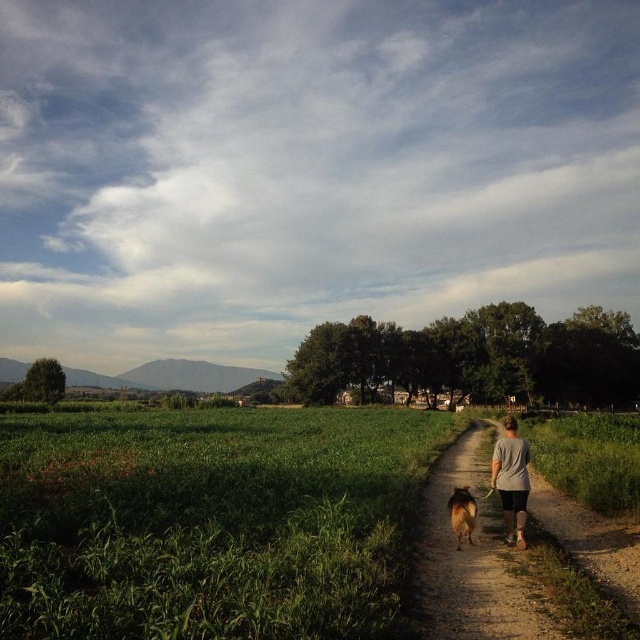
Does gray fabric shirt at center have a larger size compared to brown furry dog at center?

Indeed, gray fabric shirt at center has a larger size compared to brown furry dog at center.

Can you confirm if gray fabric shirt at center is positioned to the right of brown furry dog at center?

Yes, gray fabric shirt at center is to the right of brown furry dog at center.

Is point (506, 461) in front of point (452, 490)?

That is True.

Identify the location of gray fabric shirt at center. The height and width of the screenshot is (640, 640). (512, 481).

Is dirt path at center bigger than gray fabric shirt at center?

Yes.

Identify the location of dirt path at center. The width and height of the screenshot is (640, 640). (499, 566).

This screenshot has width=640, height=640. What are the coordinates of `dirt path at center` in the screenshot? It's located at (499, 566).

Can you confirm if dirt path at center is shorter than brown furry dog at center?

No.

Consider the image. Is dirt path at center to the left of brown furry dog at center from the viewer's perspective?

No, dirt path at center is not to the left of brown furry dog at center.

Between point (429, 628) and point (465, 518), which one is positioned behind?

Point (465, 518)

The width and height of the screenshot is (640, 640). Find the location of `dirt path at center`. dirt path at center is located at coordinates (499, 566).